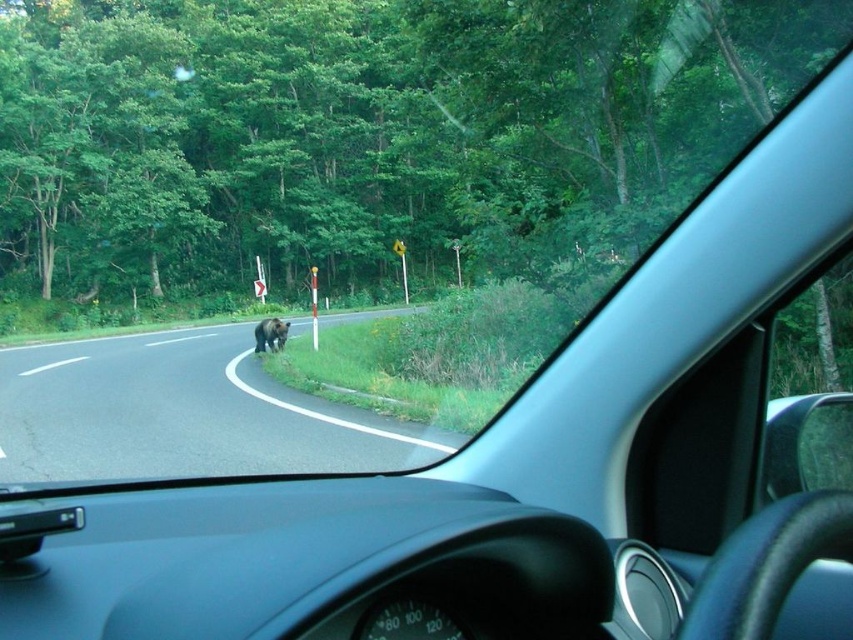
You are driving a car and see the dark asphalt road at center and the brown furry bear at center. Which object is closer to the front of the car?

The dark asphalt road at center is closer to the front of the car because it is positioned below the brown furry bear at center, indicating it is in a lower part of the frame which corresponds to the road ahead.

You are driving a car and notice a brown furry bear at center walking near the dark asphalt road at center. Based on their positions, which object is closer to you as the driver?

The dark asphalt road at center is closer to the viewer than the brown furry bear at center, so the road is closer to you as the driver.